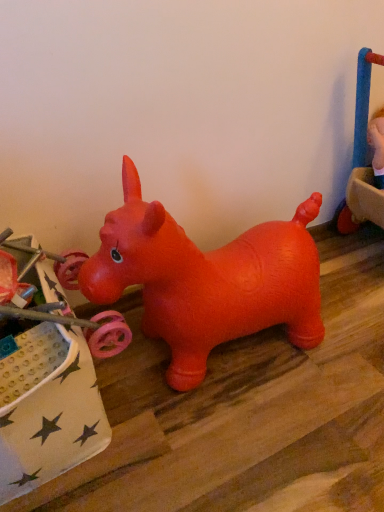
Question: Is rubber dog at upper right, positioned as the second toy in left-to-right order, situated inside rubber dog at center, marked as the 2th toy in a back-to-front arrangement, or outside?

Choices:
 (A) outside
 (B) inside

Answer: (A)

Question: Relative to rubber dog at center, which is counted as the 1th toy, starting from the front, is rubber dog at upper right, positioned as the second toy in left-to-right order, in front or behind?

Choices:
 (A) front
 (B) behind

Answer: (B)

Question: Looking at the image, does rubber dog at upper right, acting as the 1th toy starting from the top, seem bigger or smaller compared to rubber dog at center, the second toy when ordered from top to bottom?

Choices:
 (A) big
 (B) small

Answer: (B)

Question: Considering the positions of rubber dog at center, the 1th toy in the left-to-right sequence, and rubber dog at upper right, acting as the 2th toy starting from the front, in the image, is rubber dog at center, the 1th toy in the left-to-right sequence, taller or shorter than rubber dog at upper right, acting as the 2th toy starting from the front,?

Choices:
 (A) tall
 (B) short

Answer: (A)

Question: Considering the positions of rubber dog at center, which is counted as the 1th toy, starting from the front, and rubber dog at upper right, acting as the 2th toy starting from the front, in the image, is rubber dog at center, which is counted as the 1th toy, starting from the front, wider or thinner than rubber dog at upper right, acting as the 2th toy starting from the front,?

Choices:
 (A) wide
 (B) thin

Answer: (A)

Question: From a real-world perspective, relative to rubber dog at upper right, which is counted as the 1th toy, starting from the back, is rubber dog at center, the second toy viewed from the right, vertically above or below?

Choices:
 (A) below
 (B) above

Answer: (A)

Question: Is point (14, 431) positioned closer to the camera than point (354, 121)?

Choices:
 (A) farther
 (B) closer

Answer: (B)